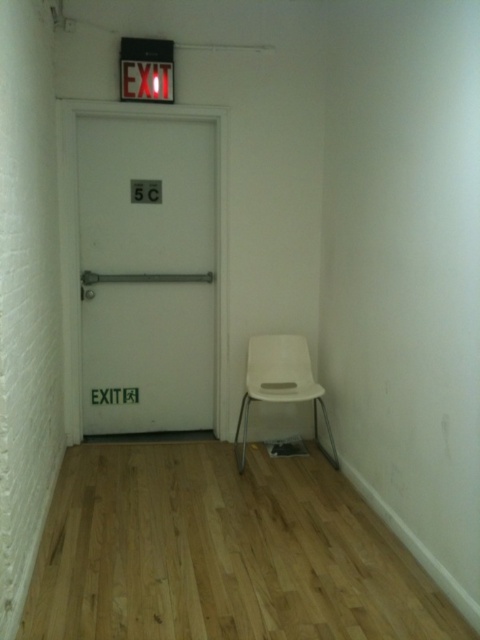
You are a delivery person trying to find the correct apartment. You see the white matte door at center and the red plastic exit sign at upper center. Which one is larger in size?

The white matte door at center is bigger than the red plastic exit sign at upper center.

Based on the photo, you are moving a white plastic chair at lower right into the hallway. The white matte door at center is in your way. Can you move the chair past the door without lifting it over the door?

The white plastic chair at lower right is behind white matte door at center, so it is already positioned behind the door. To move it past the door, you would need to pull it forward through the space in front of the door, which should be possible as long as there is enough clearance. However, since the door has a metal bar across its middle, you must ensure that the chair does not collide with the bar during movement. Carefully maneuvering the chair around or under the metal bar would allow it to pass the

You are moving a white plastic chair at lower right into the hallway. The red plastic exit sign at upper center is in the way. Can you move the chair past the sign without tilting it?

The white plastic chair at lower right might be wider than the red plastic exit sign at upper center, so it might not fit through the space. Check the width before moving it.